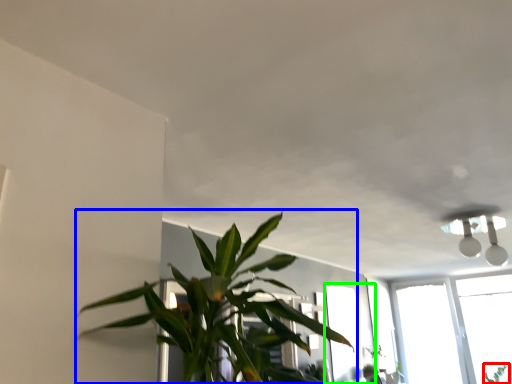
Question: Which object is the farthest from plant (highlighted by a red box)? Choose among these: houseplant (highlighted by a blue box) or window (highlighted by a green box).

Choices:
 (A) houseplant
 (B) window

Answer: (A)